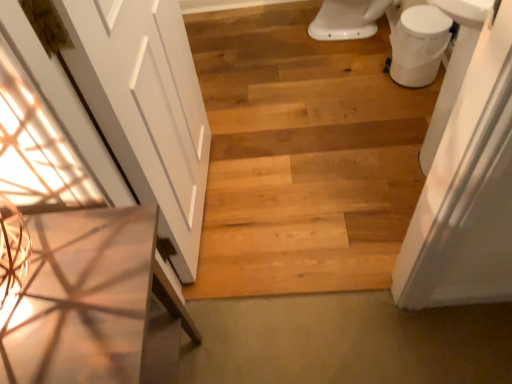
Where is `vacant space behind white glossy toilet bowl at upper right`? The image size is (512, 384). vacant space behind white glossy toilet bowl at upper right is located at coordinates (375, 52).